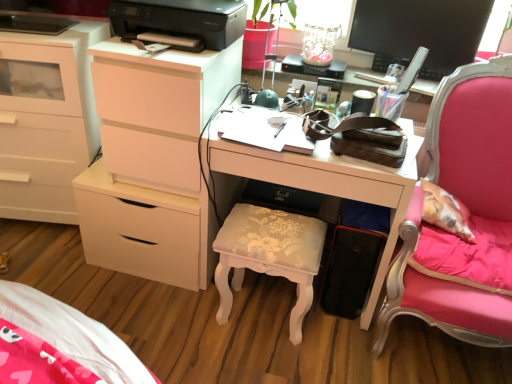
Question: Based on their sizes in the image, would you say pink fabric chair at right is bigger or smaller than white glossy desk at center?

Choices:
 (A) small
 (B) big

Answer: (B)

Question: Choose the correct answer: Is pink fabric chair at right inside white glossy desk at center or outside it?

Choices:
 (A) outside
 (B) inside

Answer: (A)

Question: Which is farther from the black glossy monitor at upper right?

Choices:
 (A) pink fabric chair at right
 (B) white matte chest of drawers at left, marked as the second chest of drawers in a right-to-left arrangement
 (C) white glossy desk at center
 (D) white floral-patterned stool at center
 (E) black plastic printer at upper center

Answer: (B)

Question: Estimate the real-world distances between objects in this image. Which object is farther from the white matte chest of drawers at left, marked as the second chest of drawers in a right-to-left arrangement?

Choices:
 (A) white glossy desk at center
 (B) black plastic printer at upper center
 (C) black glossy monitor at upper right
 (D) white matte chest of drawers at left, the first chest of drawers viewed from the right
 (E) pink fabric chair at right

Answer: (E)